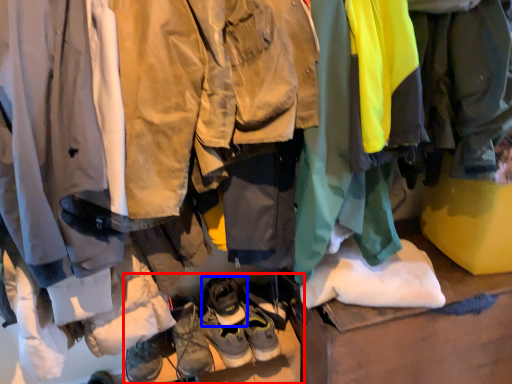
Question: Which of the following is the farthest to the observer, footwear (highlighted by a red box) or footwear (highlighted by a blue box)?

Choices:
 (A) footwear
 (B) footwear

Answer: (A)